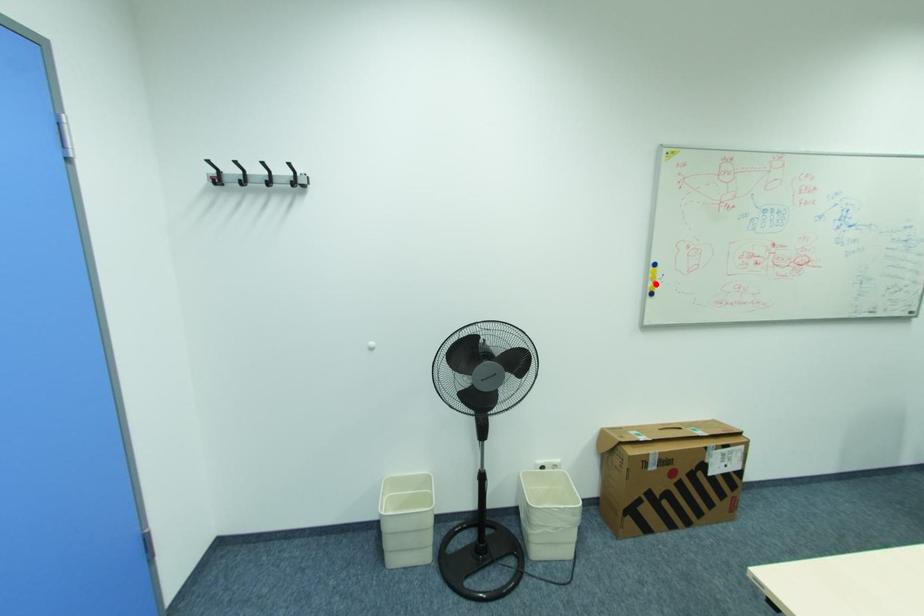
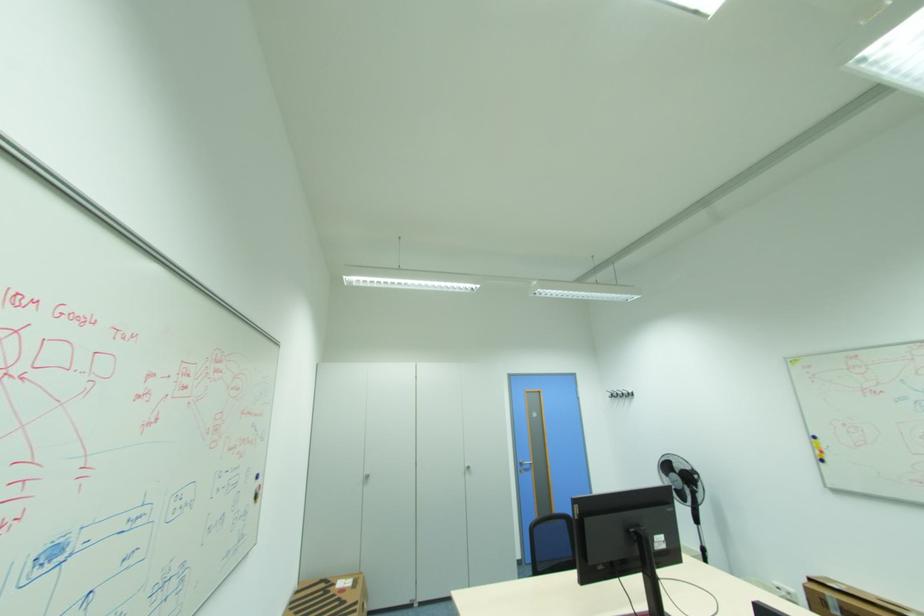
The point at the highlighted location is marked in the first image. Where is the corresponding point in the second image?

(822, 453)